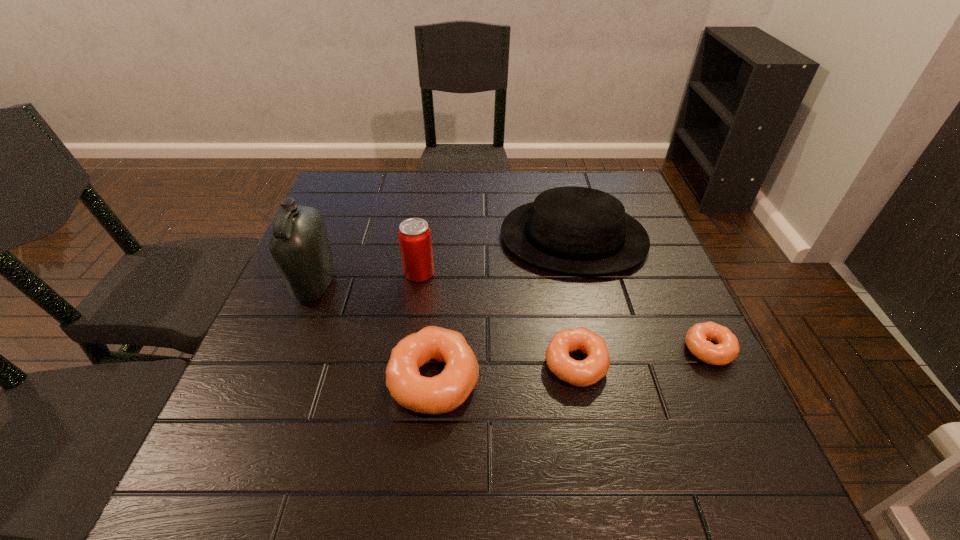
Choose which doughnut is the nearest neighbor to the shortest object. Please provide its 2D coordinates. Your answer should be formatted as a tuple, i.e. [(x, y)], where the tuple contains the x and y coordinates of a point satisfying the conditions above.

[(589, 371)]

In order to click on free space that satisfies the following two spatial constraints: 1. on the back side of the tallest doughnut; 2. on the left side of the shortest doughnut in this screenshot , I will do `click(437, 349)`.

Where is `vacant space that satisfies the following two spatial constraints: 1. on the front side of the can; 2. on the left side of the second tallest doughnut`? Image resolution: width=960 pixels, height=540 pixels. vacant space that satisfies the following two spatial constraints: 1. on the front side of the can; 2. on the left side of the second tallest doughnut is located at coordinates (406, 364).